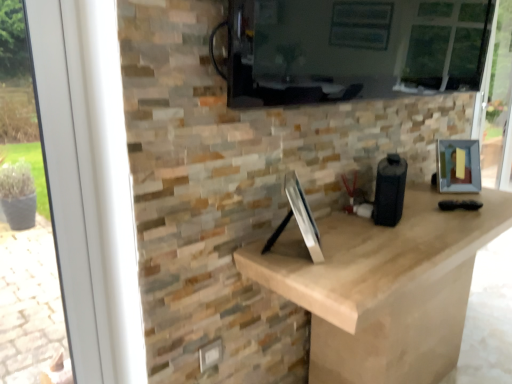
This screenshot has height=384, width=512. What do you see at coordinates (458, 166) in the screenshot? I see `metallic silver picture frame at right` at bounding box center [458, 166].

The image size is (512, 384). Find the location of `matte black screen at upper center`. matte black screen at upper center is located at coordinates (352, 49).

Find the location of a particular element. This screenshot has height=384, width=512. white plastic window frame at left is located at coordinates (89, 184).

Where is `metallic silver picture frame at right`? The height and width of the screenshot is (384, 512). metallic silver picture frame at right is located at coordinates (458, 166).

Is white plastic window frame at left completely or partially inside metallic silver picture frame at right?

No, white plastic window frame at left is located outside of metallic silver picture frame at right.

Considering the relative sizes of metallic silver picture frame at right and white plastic window frame at left in the image provided, is metallic silver picture frame at right smaller than white plastic window frame at left?

Yes.

Between metallic silver picture frame at right and white plastic window frame at left, which one appears on the right side from the viewer's perspective?

Positioned to the right is metallic silver picture frame at right.

Is white plastic window frame at left to the left of matte black screen at upper center from the viewer's perspective?

Indeed, white plastic window frame at left is positioned on the left side of matte black screen at upper center.

Is white plastic window frame at left not inside matte black screen at upper center?

Indeed, white plastic window frame at left is completely outside matte black screen at upper center.

From the image's perspective, does white plastic window frame at left appear higher than matte black screen at upper center?

Incorrect, from the image's perspective, white plastic window frame at left is lower than matte black screen at upper center.

Is point (101, 85) positioned before point (252, 72)?

Yes.

Where is `window screen that is above the metallic silver picture frame at right (from the image's perspective)`? window screen that is above the metallic silver picture frame at right (from the image's perspective) is located at coordinates (352, 49).

Considering the sizes of matte black screen at upper center and metallic silver picture frame at right in the image, is matte black screen at upper center taller or shorter than metallic silver picture frame at right?

In the image, matte black screen at upper center appears to be taller than metallic silver picture frame at right.

Between matte black screen at upper center and metallic silver picture frame at right, which one has larger size?

matte black screen at upper center is bigger.

Which object is further away from the camera, matte black screen at upper center or metallic silver picture frame at right?

metallic silver picture frame at right is further away from the camera.

Measure the distance between matte black screen at upper center and white plastic window frame at left.

matte black screen at upper center and white plastic window frame at left are 35.89 inches apart from each other.

Where is `window screen positioned vertically above the white plastic window frame at left (from a real-world perspective)`? The height and width of the screenshot is (384, 512). window screen positioned vertically above the white plastic window frame at left (from a real-world perspective) is located at coordinates (352, 49).

Which is more to the right, matte black screen at upper center or white plastic window frame at left?

From the viewer's perspective, matte black screen at upper center appears more on the right side.

Is point (236, 47) positioned in front of point (67, 8)?

Yes, it is.

From the image's perspective, which one is positioned lower, metallic silver picture frame at right or matte black screen at upper center?

metallic silver picture frame at right appears lower in the image.

From a real-world perspective, is metallic silver picture frame at right below matte black screen at upper center?

Yes, from a real-world perspective, metallic silver picture frame at right is under matte black screen at upper center.

Consider the image. Considering the sizes of objects metallic silver picture frame at right and matte black screen at upper center in the image provided, who is smaller, metallic silver picture frame at right or matte black screen at upper center?

metallic silver picture frame at right is smaller.

In the scene shown: Between metallic silver picture frame at right and matte black screen at upper center, which one appears on the right side from the viewer's perspective?

metallic silver picture frame at right is more to the right.

Locate an element on the screen. This screenshot has width=512, height=384. picture frame behind the white plastic window frame at left is located at coordinates (458, 166).

From the image's perspective, is white plastic window frame at left beneath metallic silver picture frame at right?

Yes.

Which is more to the left, white plastic window frame at left or metallic silver picture frame at right?

From the viewer's perspective, white plastic window frame at left appears more on the left side.

At what (x,y) coordinates should I click in order to perform the action: click on picture frame that appears below the white plastic window frame at left (from a real-world perspective). Please return your answer as a coordinate pair (x, y). This screenshot has height=384, width=512. Looking at the image, I should click on (458, 166).

The width and height of the screenshot is (512, 384). I want to click on window frame on the left side of matte black screen at upper center, so click(89, 184).

Looking at the image, which one is located closer to white plastic window frame at left, matte black screen at upper center or metallic silver picture frame at right?

Based on the image, matte black screen at upper center appears to be nearer to white plastic window frame at left.

When comparing their distances from white plastic window frame at left, does metallic silver picture frame at right or matte black screen at upper center seem further?

metallic silver picture frame at right lies further to white plastic window frame at left than the other object.

When comparing their distances from matte black screen at upper center, does metallic silver picture frame at right or white plastic window frame at left seem further?

The object further to matte black screen at upper center is white plastic window frame at left.

Considering their positions, is white plastic window frame at left positioned closer to metallic silver picture frame at right than matte black screen at upper center?

matte black screen at upper center is positioned closer to the anchor metallic silver picture frame at right.

From the image, which object appears to be farther from matte black screen at upper center, white plastic window frame at left or metallic silver picture frame at right?

white plastic window frame at left is positioned further to the anchor matte black screen at upper center.

Estimate the real-world distances between objects in this image. Which object is closer to metallic silver picture frame at right, matte black screen at upper center or white plastic window frame at left?

matte black screen at upper center is closer to metallic silver picture frame at right.

The image size is (512, 384). I want to click on window screen between white plastic window frame at left and metallic silver picture frame at right in the horizontal direction, so click(x=352, y=49).